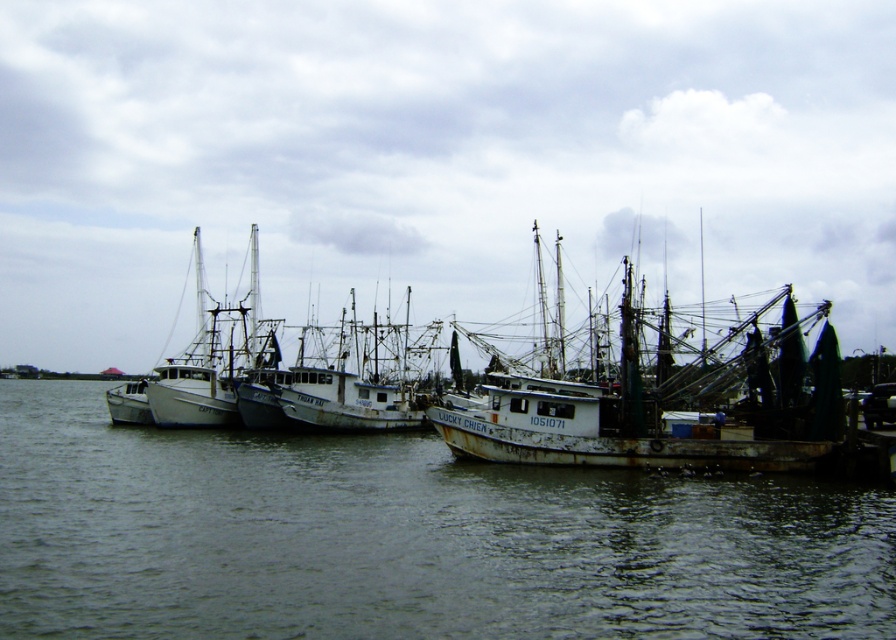
In the scene shown: Can you confirm if gray matte water at lower left is wider than rusty metal boat at center?

Yes, gray matte water at lower left is wider than rusty metal boat at center.

Between gray matte water at lower left and rusty metal boat at center, which one is positioned lower?

gray matte water at lower left

Where is `gray matte water at lower left`? Image resolution: width=896 pixels, height=640 pixels. gray matte water at lower left is located at coordinates (407, 540).